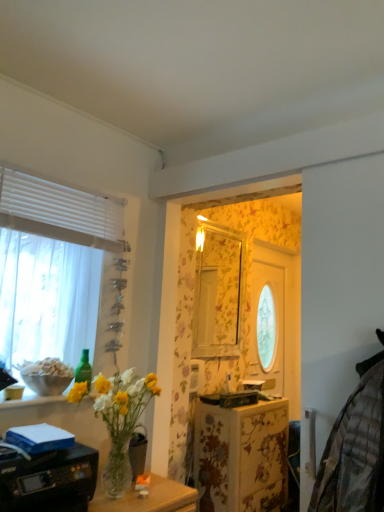
Question: From the image's perspective, is black plastic printer at lower left above clear glass vase at lower left?

Choices:
 (A) no
 (B) yes

Answer: (A)

Question: Considering the relative sizes of black plastic printer at lower left and clear glass vase at lower left in the image provided, is black plastic printer at lower left bigger than clear glass vase at lower left?

Choices:
 (A) no
 (B) yes

Answer: (A)

Question: Can you confirm if black plastic printer at lower left is taller than clear glass vase at lower left?

Choices:
 (A) no
 (B) yes

Answer: (A)

Question: Is black plastic printer at lower left at the right side of clear glass vase at lower left?

Choices:
 (A) yes
 (B) no

Answer: (B)

Question: Can you confirm if black plastic printer at lower left is smaller than clear glass vase at lower left?

Choices:
 (A) yes
 (B) no

Answer: (A)

Question: Could you tell me if black plastic printer at lower left is facing clear glass vase at lower left?

Choices:
 (A) no
 (B) yes

Answer: (A)

Question: Is green glass bottle at upper left wider than clear glass vase at lower left?

Choices:
 (A) no
 (B) yes

Answer: (A)

Question: Is green glass bottle at upper left facing towards clear glass vase at lower left?

Choices:
 (A) yes
 (B) no

Answer: (A)

Question: From the image's perspective, does green glass bottle at upper left appear lower than clear glass vase at lower left?

Choices:
 (A) yes
 (B) no

Answer: (B)

Question: Is green glass bottle at upper left far from clear glass vase at lower left?

Choices:
 (A) yes
 (B) no

Answer: (B)

Question: Is the position of green glass bottle at upper left more distant than that of clear glass vase at lower left?

Choices:
 (A) no
 (B) yes

Answer: (B)

Question: From a real-world perspective, is green glass bottle at upper left on clear glass vase at lower left?

Choices:
 (A) yes
 (B) no

Answer: (A)

Question: Could you tell me if white sheer curtain at left is turned towards clear glass vase at lower left?

Choices:
 (A) yes
 (B) no

Answer: (B)